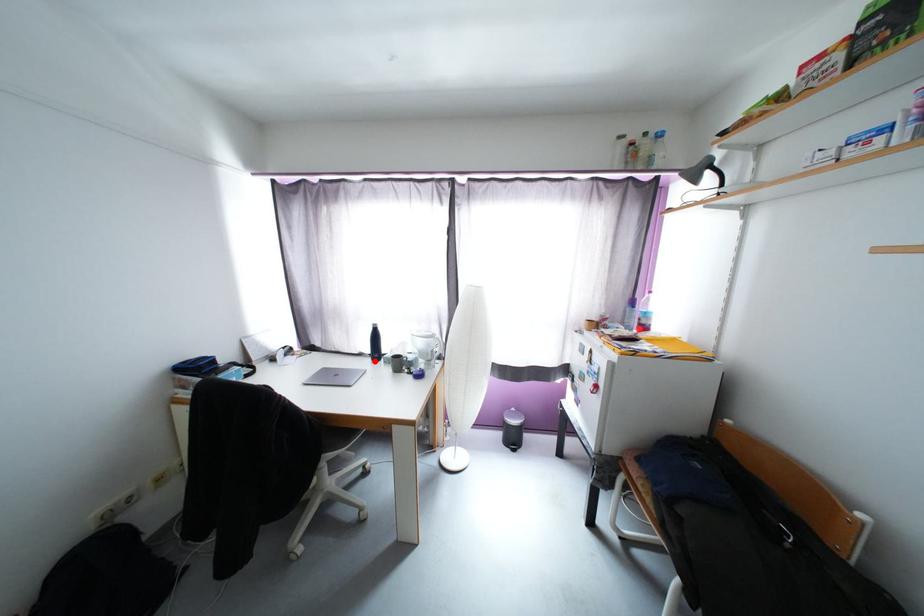
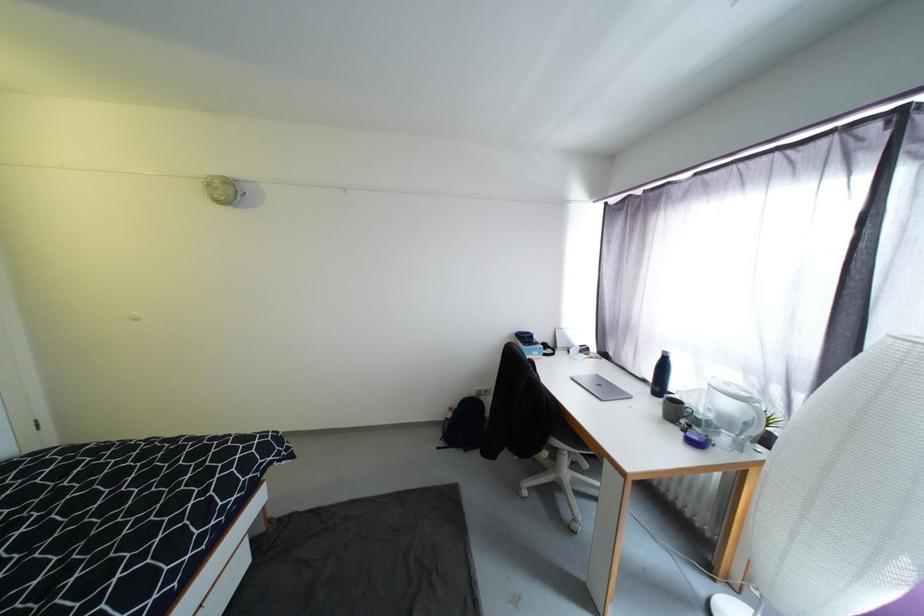
Where in the second image is the point corresponding to the highlighted location from the first image?

(654, 392)